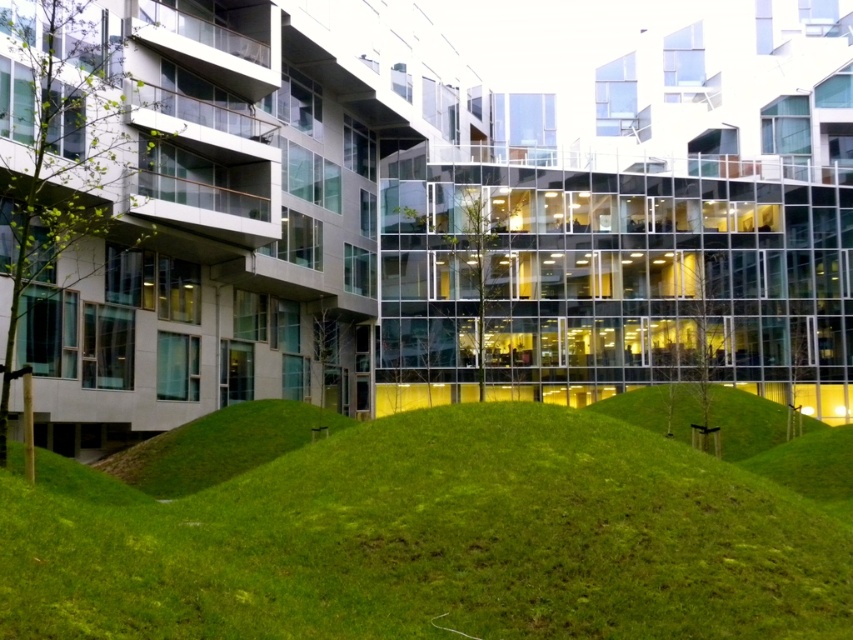
You are standing at the base of the green grassy hill at center. Looking towards the modern architectural structure with glass windows and balconies, which direction should you face to see the building clearly?

The green grassy hill at center is located at point (432, 540), so you should face towards the building which is in front of the hill to see it clearly.

You are standing at the base of the green grassy hill at center and the green grassy mound at center. Which one would require more effort to climb to the top?

The green grassy mound at center would require more effort to climb to the top since it is taller than the green grassy hill at center.

You are standing at the base of the green grassy hill at center and the green grassy mound at center. Which one is wider?

The green grassy mound at center is wider than the green grassy hill at center.